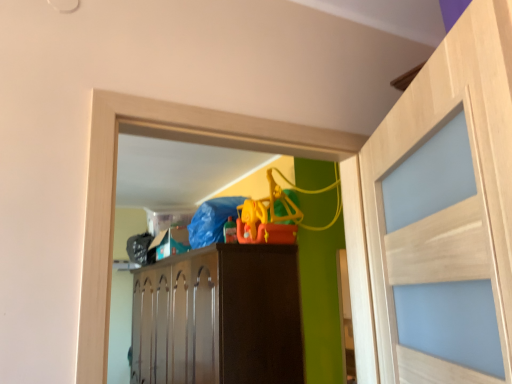
Question: Should I look upward or downward to see light wood door at right?

Choices:
 (A) up
 (B) down

Answer: (B)

Question: From the image's perspective, does light wood door at right appear higher than brown wood cabinet at center?

Choices:
 (A) no
 (B) yes

Answer: (B)

Question: Can you confirm if light wood door at right is wider than brown wood cabinet at center?

Choices:
 (A) yes
 (B) no

Answer: (B)

Question: From a real-world perspective, is light wood door at right located beneath brown wood cabinet at center?

Choices:
 (A) no
 (B) yes

Answer: (A)

Question: Is light wood door at right thinner than brown wood cabinet at center?

Choices:
 (A) no
 (B) yes

Answer: (B)

Question: Is light wood door at right next to brown wood cabinet at center?

Choices:
 (A) yes
 (B) no

Answer: (B)

Question: Is light wood door at right smaller than brown wood cabinet at center?

Choices:
 (A) yes
 (B) no

Answer: (A)

Question: Is brown wood cabinet at center behind light wood door at right?

Choices:
 (A) yes
 (B) no

Answer: (A)

Question: Is brown wood cabinet at center facing towards light wood door at right?

Choices:
 (A) yes
 (B) no

Answer: (B)

Question: Is brown wood cabinet at center turned away from light wood door at right?

Choices:
 (A) no
 (B) yes

Answer: (A)

Question: Considering the relative positions of brown wood cabinet at center and light wood door at right in the image provided, is brown wood cabinet at center to the right of light wood door at right from the viewer's perspective?

Choices:
 (A) no
 (B) yes

Answer: (A)

Question: Is brown wood cabinet at center not inside light wood door at right?

Choices:
 (A) yes
 (B) no

Answer: (A)

Question: Considering the relative sizes of brown wood cabinet at center and light wood door at right in the image provided, is brown wood cabinet at center bigger than light wood door at right?

Choices:
 (A) no
 (B) yes

Answer: (B)

Question: From a real-world perspective, relative to brown wood cabinet at center, is light wood door at right vertically above or below?

Choices:
 (A) below
 (B) above

Answer: (B)